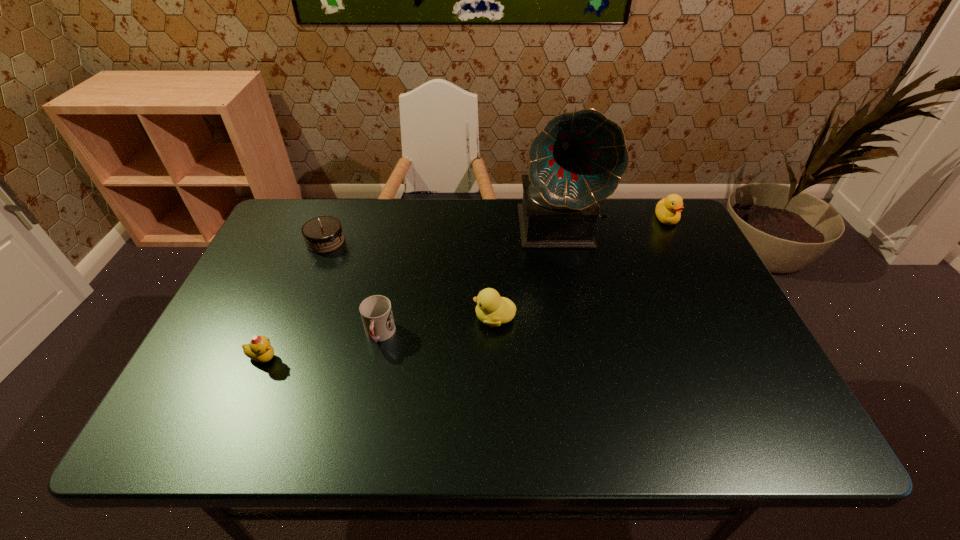
This screenshot has width=960, height=540. I want to click on chocolate cake that is at the left edge, so click(323, 234).

Image resolution: width=960 pixels, height=540 pixels. In order to click on duckling that is at the left edge in this screenshot , I will do `click(259, 349)`.

This screenshot has height=540, width=960. Identify the location of object located at the right edge. (668, 210).

Locate an element on the screen. Image resolution: width=960 pixels, height=540 pixels. object situated at the far left corner is located at coordinates (323, 234).

Identify the location of object present at the far right corner. (668, 210).

I want to click on free point at the far edge, so click(x=436, y=241).

In order to click on vacant area at the near edge of the desktop in this screenshot , I will do `click(390, 405)`.

Locate an element on the screen. blank space at the left edge of the desktop is located at coordinates (233, 367).

The image size is (960, 540). Identify the location of free region at the near left corner of the desktop. (184, 436).

Find the location of a particular element. The height and width of the screenshot is (540, 960). vacant space at the far right corner of the desktop is located at coordinates (663, 235).